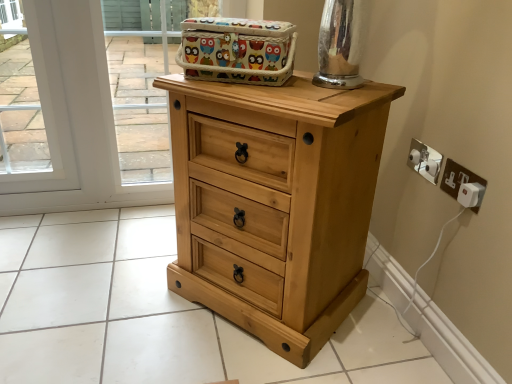
Find the location of a particular element. vacant space in front of colorful fabric basket at upper center is located at coordinates (276, 96).